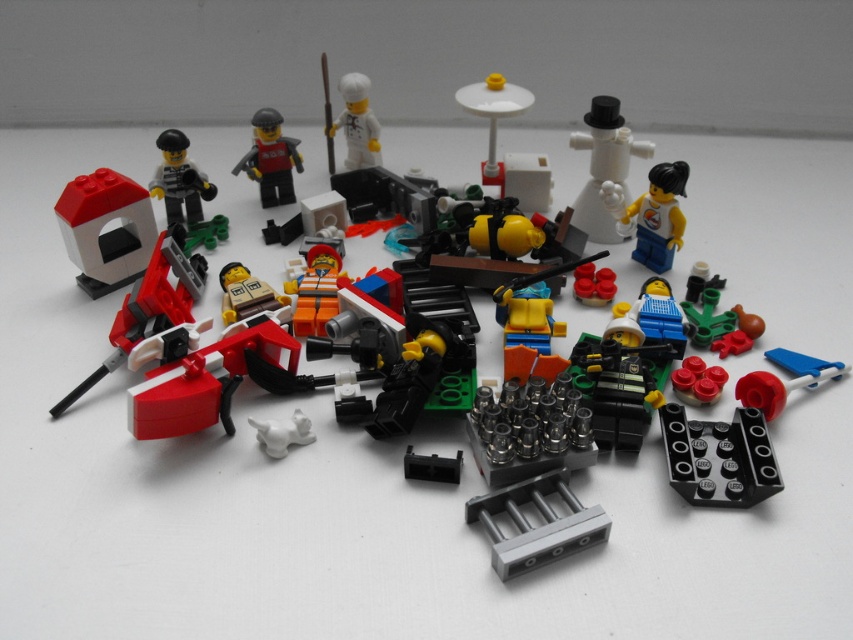
You are a robot trying to pick up the LEGO pieces. You need to reach the point at [175,396] first before moving to the point at [608,104]. Based on their positions, which point is closer to you?

Point at [175,396] is closer to you because it is in front of point at [608,104].